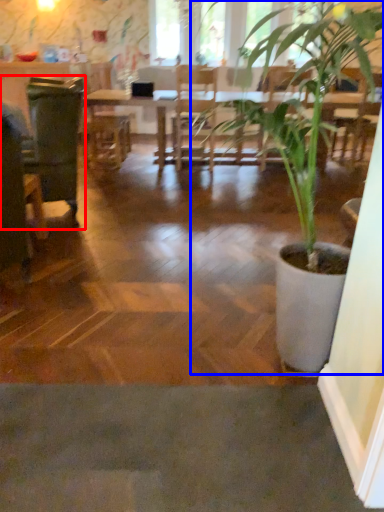
Question: Which of the following is the closest to the observer, swivel chair (highlighted by a red box) or houseplant (highlighted by a blue box)?

Choices:
 (A) swivel chair
 (B) houseplant

Answer: (B)